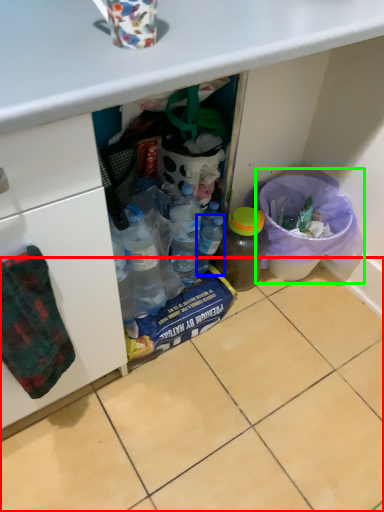
Question: Based on their relative distances, which object is farther from tile (highlighted by a red box)? Choose from bottle (highlighted by a blue box) and recycling bin (highlighted by a green box).

Choices:
 (A) bottle
 (B) recycling bin

Answer: (A)